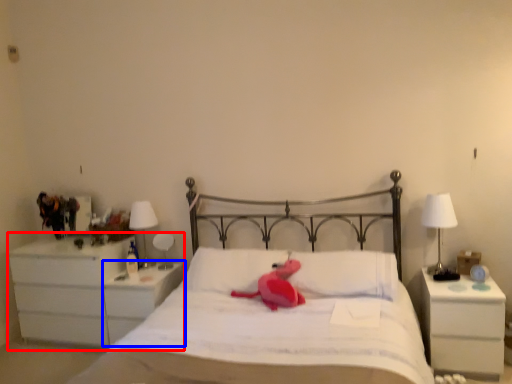
Question: Among these objects, which one is nearest to the camera, chest of drawers (highlighted by a red box) or nightstand (highlighted by a blue box)?

Choices:
 (A) chest of drawers
 (B) nightstand

Answer: (B)